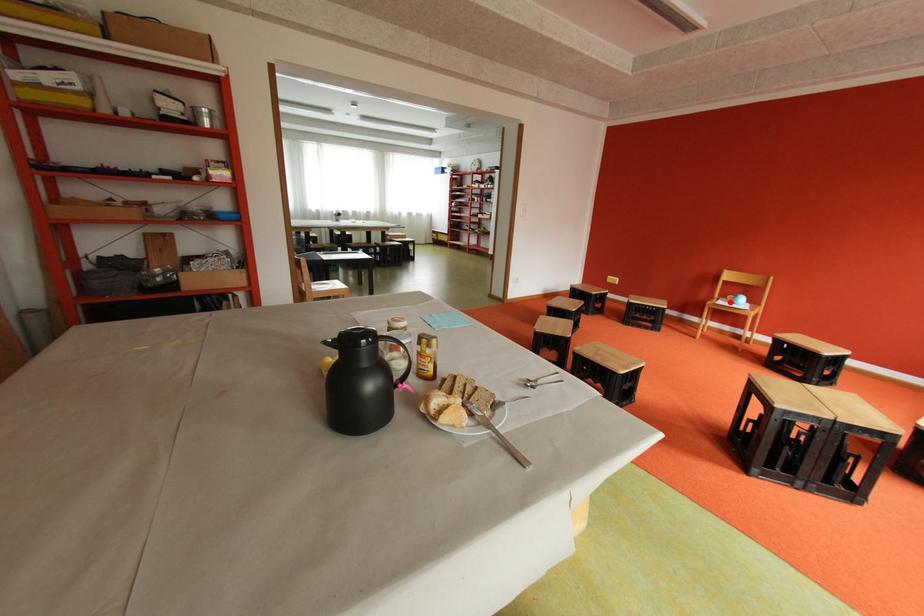
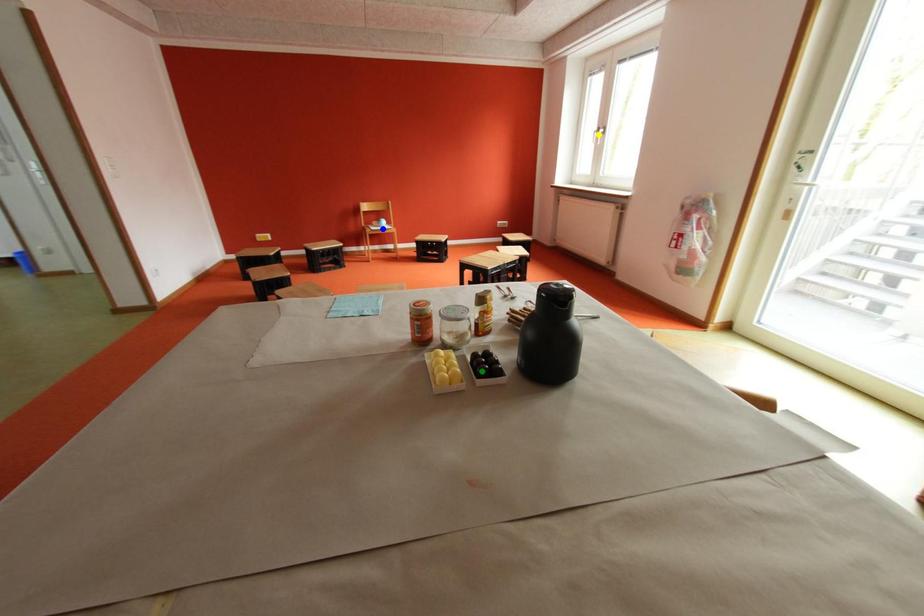
Question: I am providing you with two images of the same scene from different viewpoints. A red point is marked on the first image. You are given multiple points on the second image. Which point in image 2 is actually the same real-world point as the red point in image 1?

Choices:
 (A) blue point
 (B) green point
 (C) yellow point

Answer: (A)